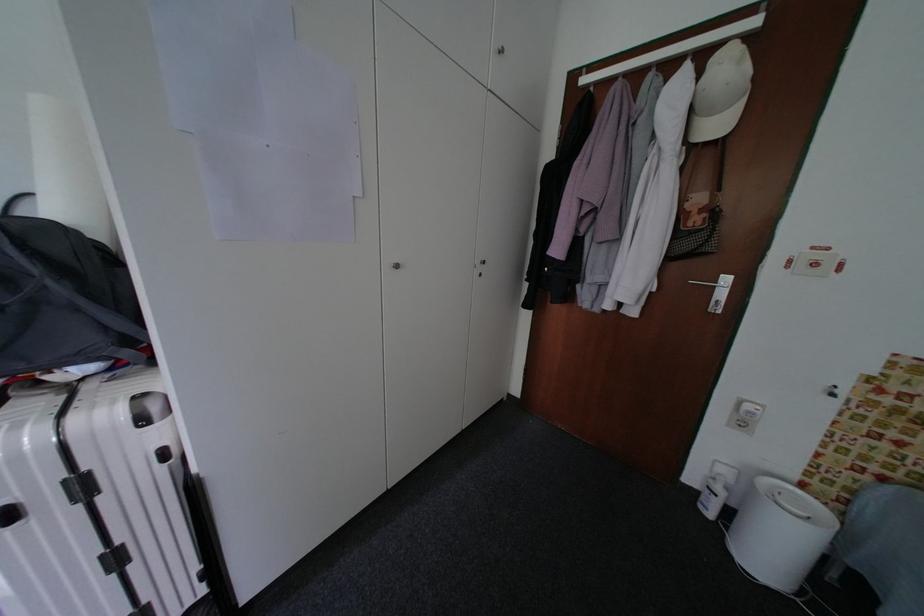
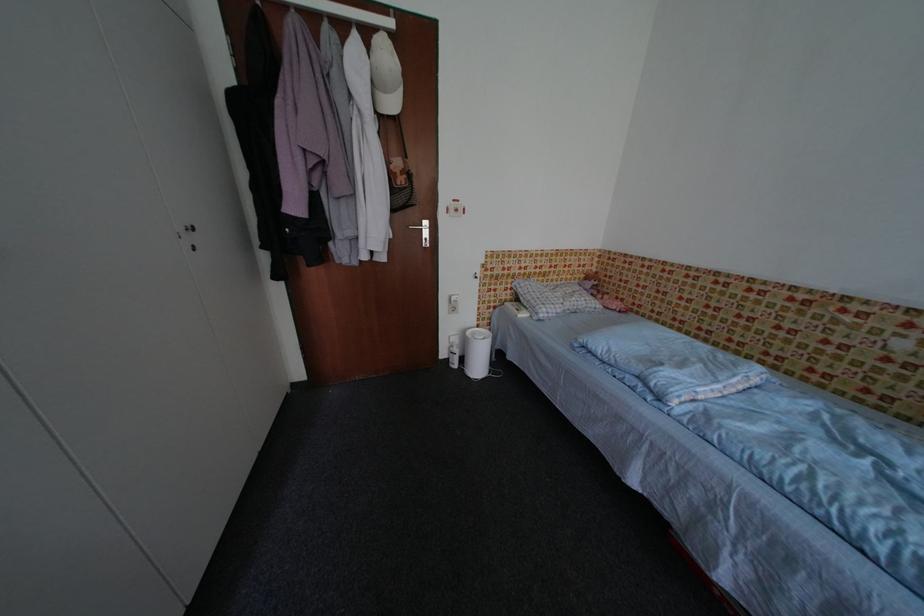
Find the pixel in the second image that matches point (701, 496) in the first image.

(455, 363)